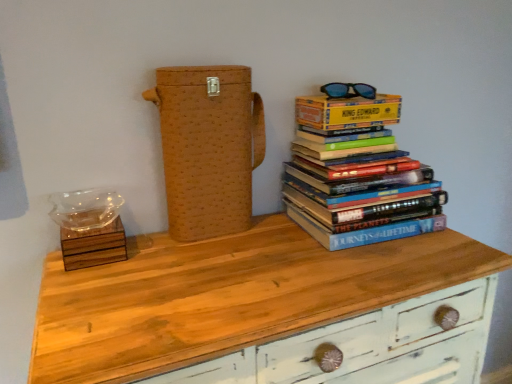
This screenshot has height=384, width=512. What are the coordinates of `free space to the left of hardcover books at upper right` in the screenshot? It's located at (260, 239).